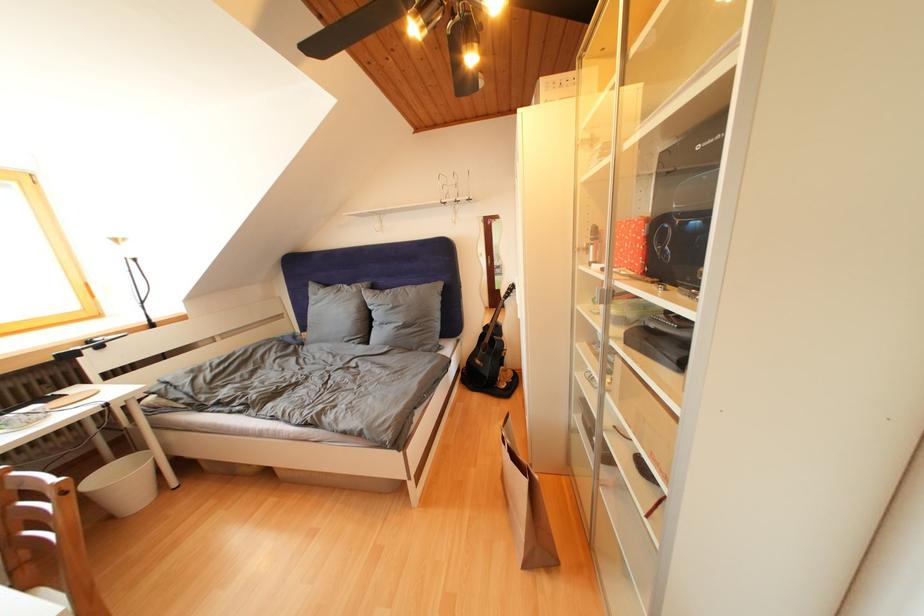
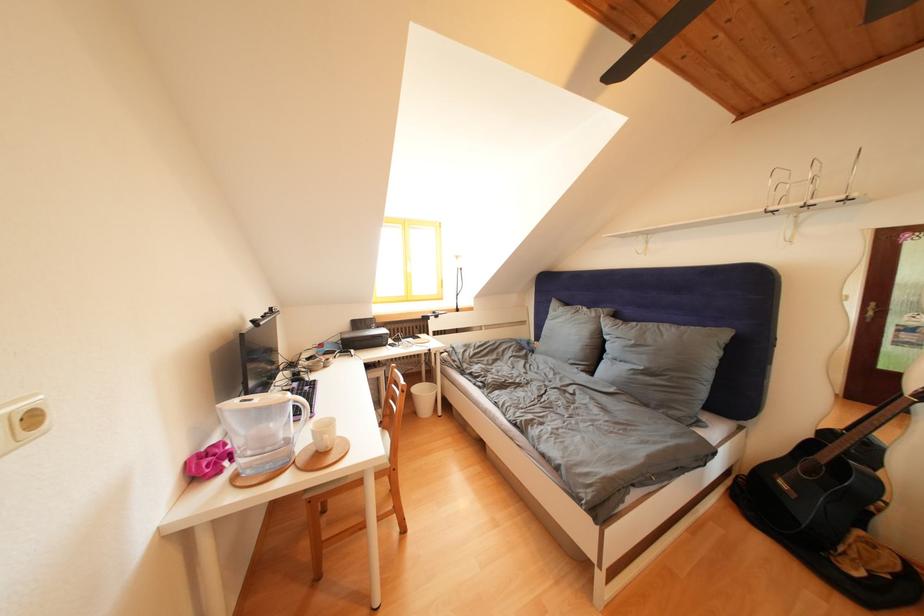
The point at [485,367] is marked in the first image. Where is the corresponding point in the second image?

(791, 488)